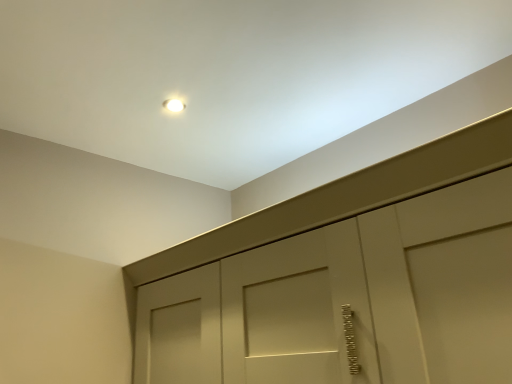
What do you see at coordinates (174, 105) in the screenshot? I see `white glossy light fixture at upper center` at bounding box center [174, 105].

You are a GUI agent. You are given a task and a screenshot of the screen. Output one action in this format:
    pyautogui.click(x=<x>, y=<y>)
    Task: Click on the white glossy light fixture at upper center
    
    Given the screenshot: What is the action you would take?
    pyautogui.click(x=174, y=105)

Locate an element on the screen. white glossy light fixture at upper center is located at coordinates (174, 105).